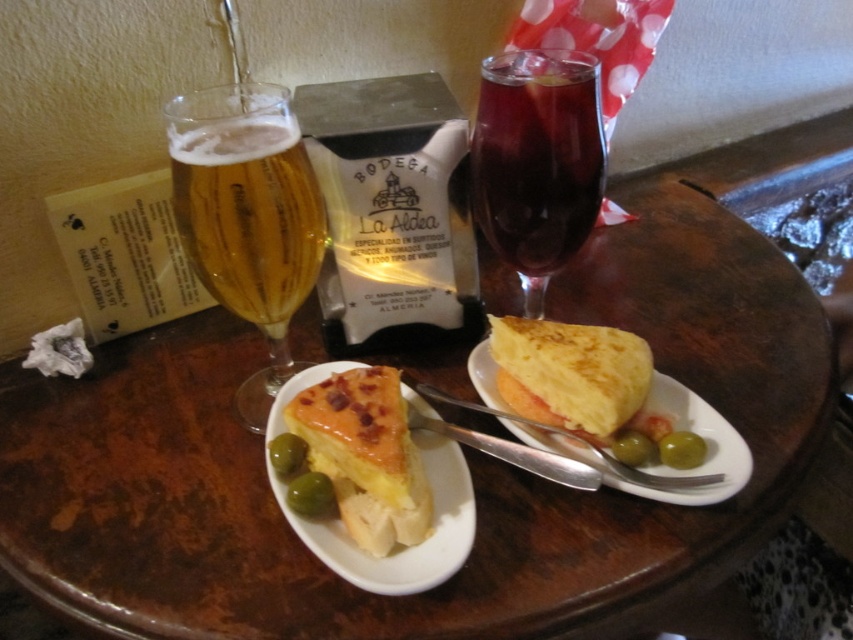
Question: Does yellow crumbly pie at center have a smaller size compared to green glossy olive at lower left?

Choices:
 (A) yes
 (B) no

Answer: (B)

Question: Can you confirm if yellow fluffy omelette at center is positioned to the left of green glossy olive at lower left?

Choices:
 (A) yes
 (B) no

Answer: (B)

Question: Which point is closer to the camera?

Choices:
 (A) (488, 108)
 (B) (570, 396)
 (C) (674, 490)
 (D) (378, 488)

Answer: (D)

Question: Which point is farther to the camera?

Choices:
 (A) golden glass beer at left
 (B) green glossy olives at lower left
 (C) yellow fluffy omelette at center

Answer: (B)

Question: Estimate the real-world distances between objects in this image. Which object is closer to the yellow crumbly pie at center?

Choices:
 (A) brown wooden table at center
 (B) green glossy olive at center

Answer: (B)

Question: Does brown wooden table at center appear on the left side of green glossy olive at lower right?

Choices:
 (A) no
 (B) yes

Answer: (B)